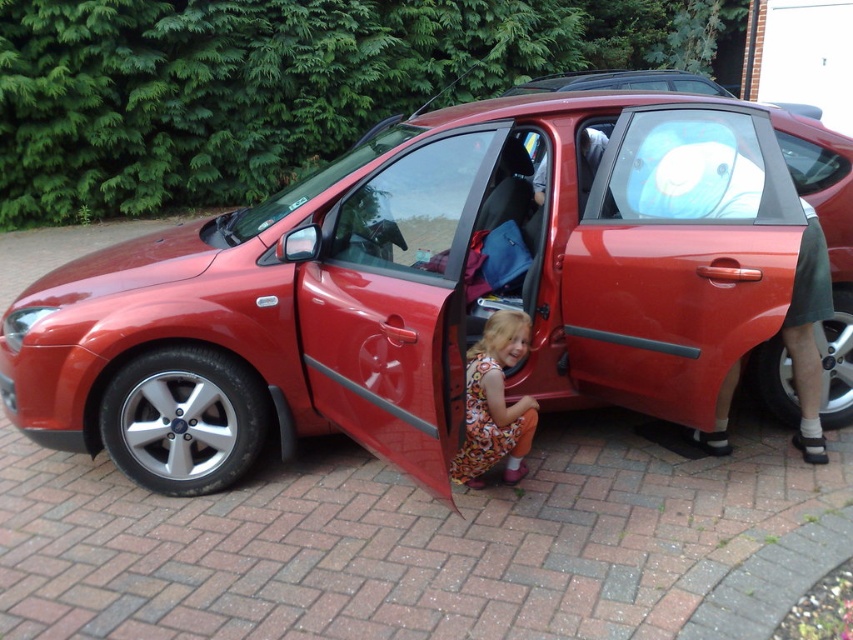
You are a delivery person trying to reach the floral dress at lower center to hand over a package. The glossy red car at center is blocking your path. Can you walk around the car to reach the dress?

The glossy red car at center is positioned over floral dress at lower center, so you can walk around the car to reach the floral dress at lower center as long as there is space around the car.